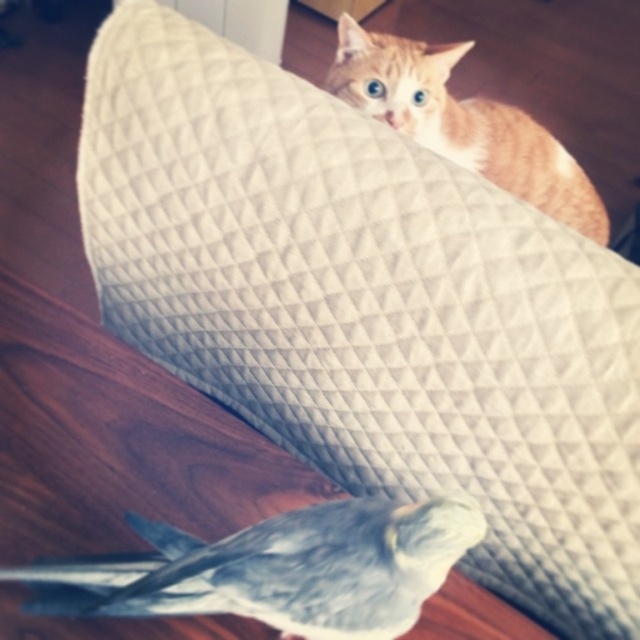
You are standing in the room and want to place a new object at the exact center of the image. Which object from the scene is closest to the center? The options are the quilted pillow, the ginger cat, or the gray matte bird at lower left.

The gray matte bird at lower left is located at point [280,568], which is closer to the center of the image compared to the other objects mentioned. Therefore, the gray matte bird at lower left is the closest to the center.

You are a toy maker designing a playset for the gray matte bird at lower left and the orange fur cat at upper right. Which toy should be placed higher to accommodate their sizes?

The orange fur cat at upper right is taller than the gray matte bird at lower left, so the toy for the orange fur cat at upper right should be placed higher to accommodate its size.